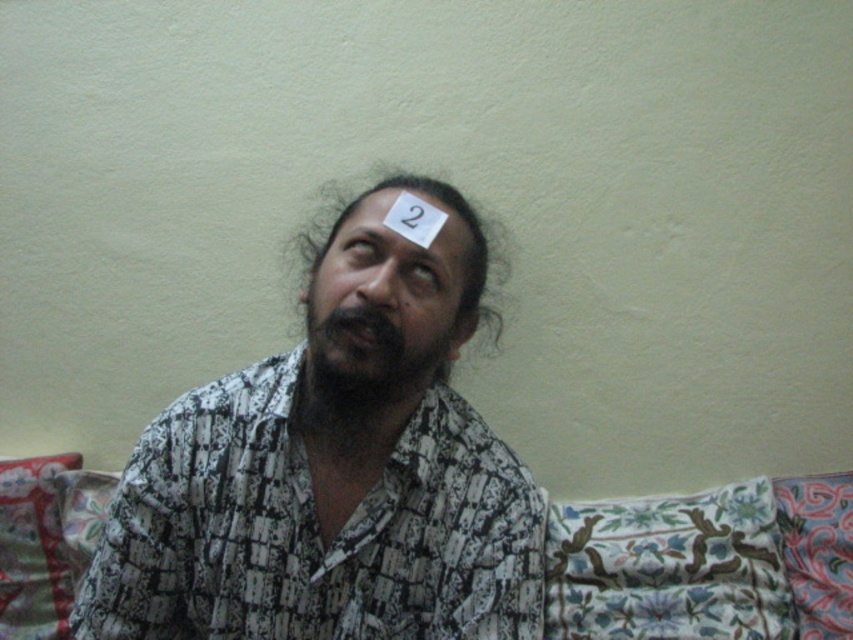
You are an interior designer trying to place a new lamp in the room. The lamp has a base that requires a clear space of 10 cm in diameter. Based on the coordinates given for the white printed shirt at center, can you confirm if placing the lamp at that exact coordinate is feasible?

The white printed shirt at center is located at point (x=334, y=474). Since the lamp requires a clear space of 10 cm in diameter, and the shirt is occupying that position, placing the lamp there would not be feasible as it would overlap with the shirt.

You are a photographer trying to capture a candid shot of the person in the scene. You are currently positioned at point (274, 516). The camera you are using has a focal length of 50mm. To ensure the subject is in focus, you need to calculate the distance between your current position and the camera. Is the distance within the optimal focusing range of 35 inches for this camera setup?

The distance between point (274, 516) and the camera is 34.97 inches, which is very close to the optimal focusing range of 35 inches. Therefore, the camera should be able to focus on the subject effectively.

You are a photographer setting up for a portrait. The subject is wearing a white printed shirt at center. You need to position a light source so that it illuminates the shirt evenly without casting harsh shadows. Given the distance between the light source and the shirt is 75.87 centimeters, what adjustment would you make to ensure proper lighting?

The light source should be positioned at least 75.87 centimeters away from the white printed shirt at center to avoid harsh shadows and ensure even illumination.